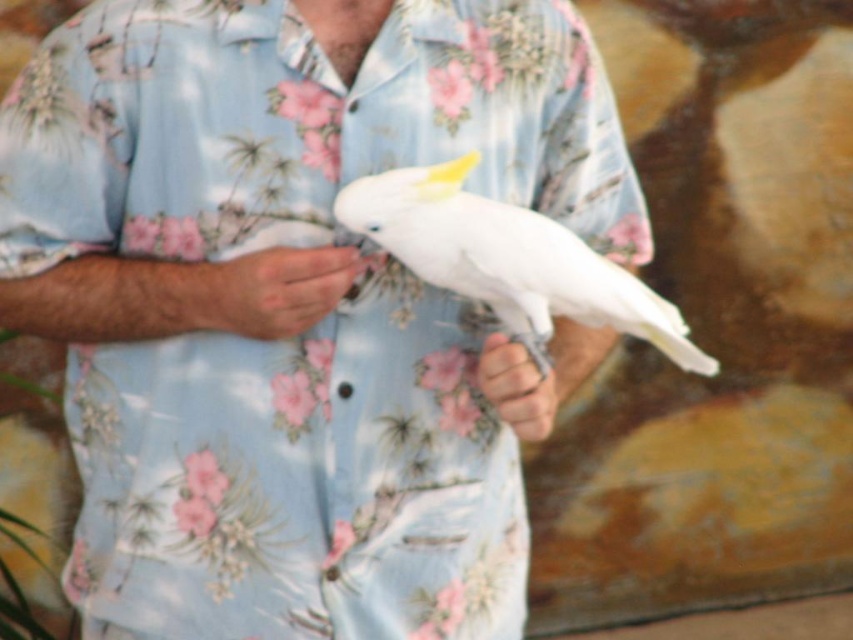
Is matte blue shirt at center to the right of smooth skin hand at center from the viewer's perspective?

No, matte blue shirt at center is not to the right of smooth skin hand at center.

Between point (48, 289) and point (547, 384), which one is positioned in front?

Point (547, 384) is in front.

Image resolution: width=853 pixels, height=640 pixels. I want to click on matte blue shirt at center, so coord(178,296).

Which is behind, point (352, 268) or point (537, 420)?

The point (352, 268) is more distant.

Is white matte hand at center wider than white feathered bird at center?

No, white matte hand at center is not wider than white feathered bird at center.

The height and width of the screenshot is (640, 853). In order to click on white matte hand at center in this screenshot , I will do `click(274, 291)`.

How distant is white feathered parrot at center from white feathered bird at center?

They are 2.91 inches apart.

Is the position of white feathered parrot at center more distant than that of white feathered bird at center?

No, it is in front of white feathered bird at center.

Image resolution: width=853 pixels, height=640 pixels. Describe the element at coordinates (508, 259) in the screenshot. I see `white feathered parrot at center` at that location.

Where is `white feathered parrot at center`? This screenshot has height=640, width=853. white feathered parrot at center is located at coordinates (508, 259).